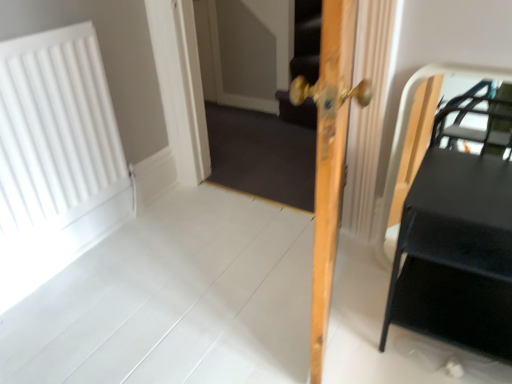
What are the coordinates of `vacant space that is to the left of light wood door at center` in the screenshot? It's located at (218, 293).